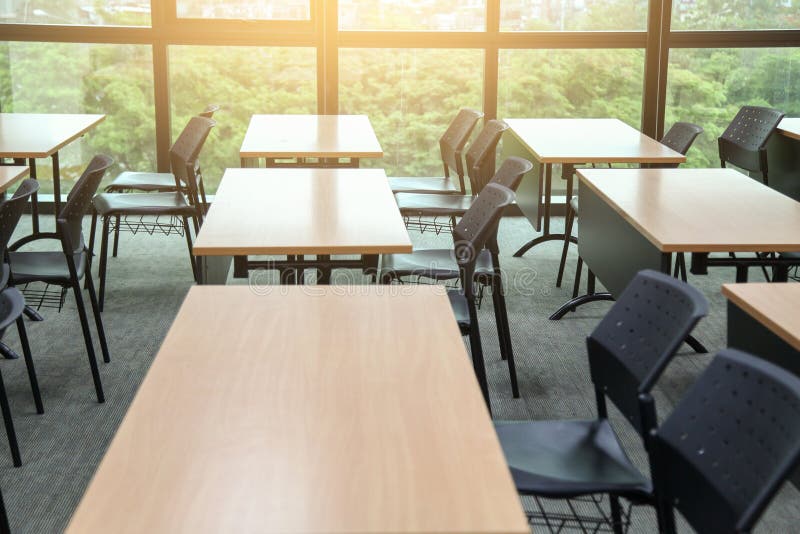
Where is `table`? The width and height of the screenshot is (800, 534). table is located at coordinates (300, 473), (338, 219), (320, 137), (525, 139), (653, 205), (765, 293), (794, 122), (58, 129), (14, 172).